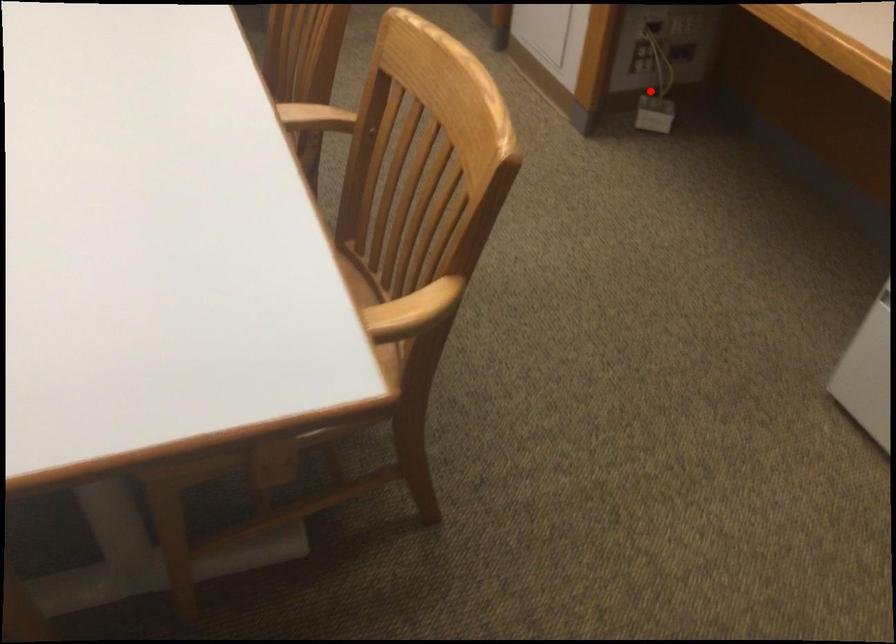
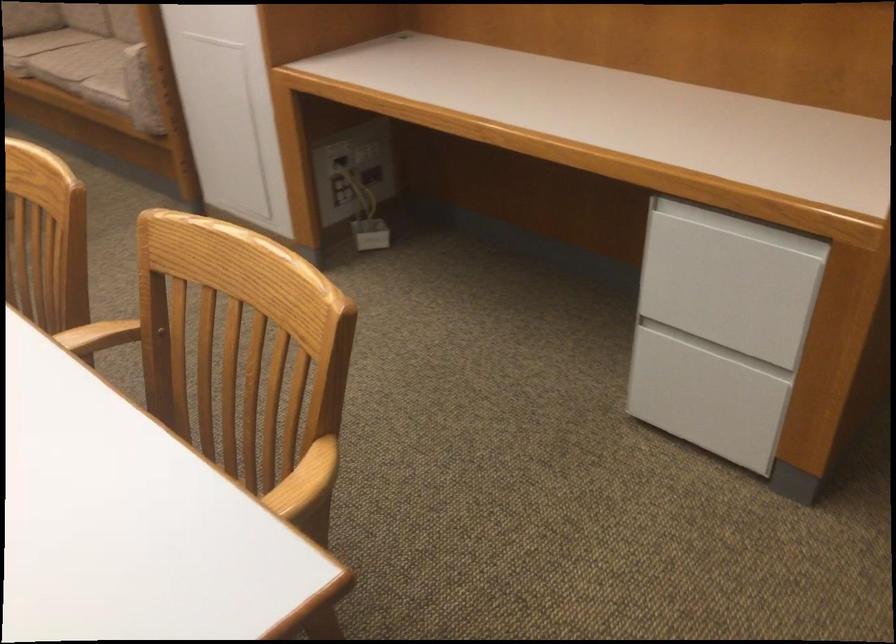
Question: I am providing you with two images of the same scene from different viewpoints. A red point is marked on the first image. Is the red point's position out of view in image 2?

Choices:
 (A) Yes
 (B) No

Answer: (B)